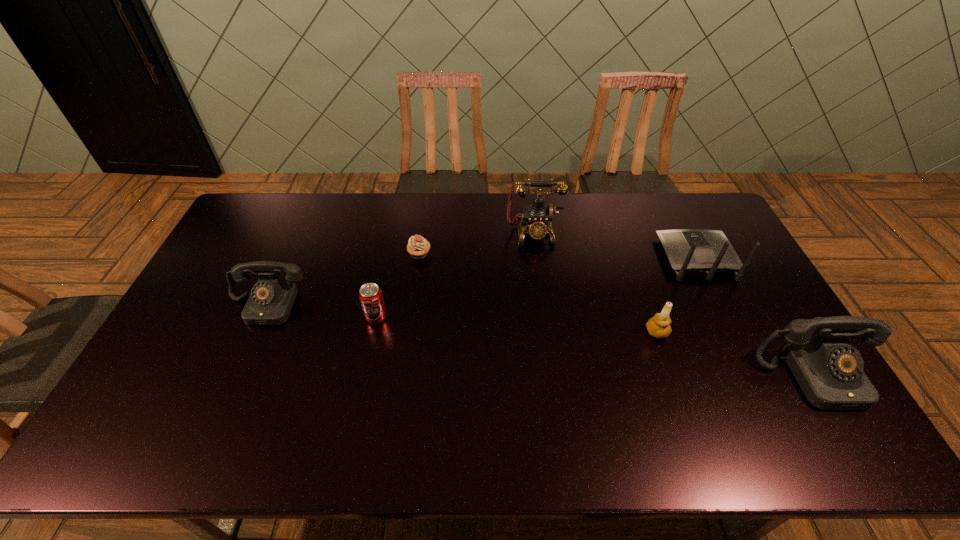
The width and height of the screenshot is (960, 540). I want to click on free point between the second farthest telephone and the nearest telephone, so click(540, 342).

Where is `the sixth closest object to the leftmost telephone`? The image size is (960, 540). the sixth closest object to the leftmost telephone is located at coordinates (829, 370).

Identify which object is located as the second nearest to the cupcake. Please provide its 2D coordinates. Your answer should be formatted as a tuple, i.e. [(x, y)], where the tuple contains the x and y coordinates of a point satisfying the conditions above.

[(538, 217)]

Select which telephone appears as the third closest to the cupcake. Please provide its 2D coordinates. Your answer should be formatted as a tuple, i.e. [(x, y)], where the tuple contains the x and y coordinates of a point satisfying the conditions above.

[(829, 370)]

Identify which telephone is the third nearest to the fifth object from left to right. Please provide its 2D coordinates. Your answer should be formatted as a tuple, i.e. [(x, y)], where the tuple contains the x and y coordinates of a point satisfying the conditions above.

[(271, 299)]